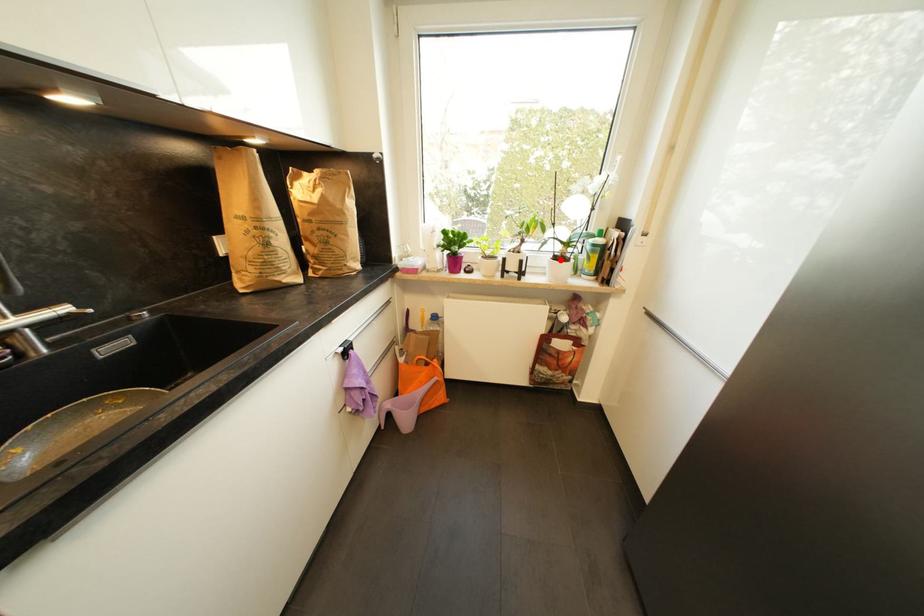
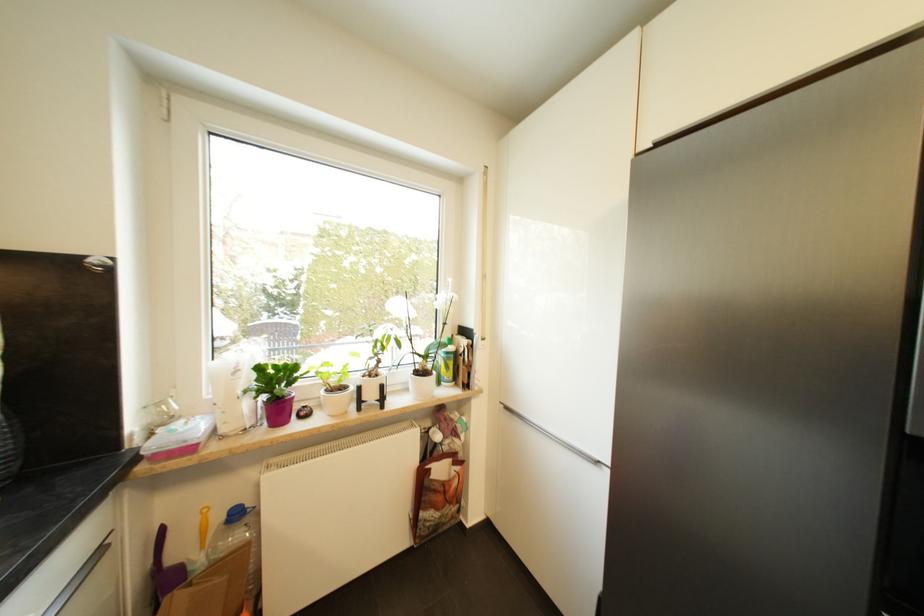
The point at the highlighted location is marked in the first image. Where is the corresponding point in the second image?

(421, 375)